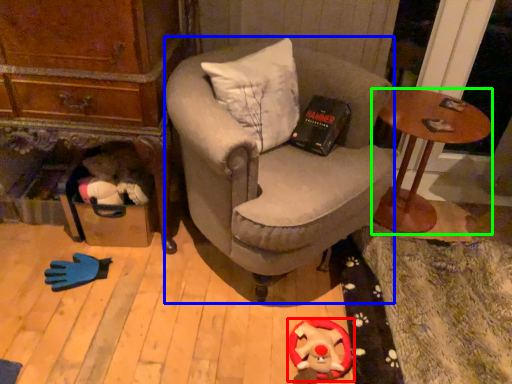
Question: Which object is positioned closest to toy (highlighted by a red box)? Select from chair (highlighted by a blue box) and desk (highlighted by a green box).

Choices:
 (A) chair
 (B) desk

Answer: (A)